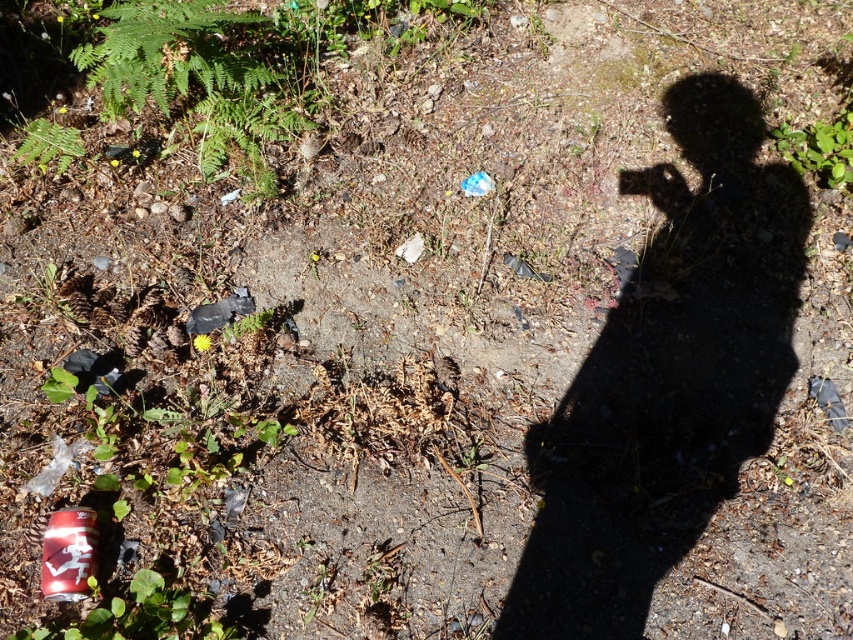
Question: Does red matte can at bottom left appear on the left side of green leafy weed at upper right?

Choices:
 (A) no
 (B) yes

Answer: (B)

Question: Which point is closer to the camera?

Choices:
 (A) red matte can at bottom left
 (B) green leafy weed at upper right

Answer: (A)

Question: Is red matte can at bottom left behind green leafy weed at upper right?

Choices:
 (A) yes
 (B) no

Answer: (B)

Question: Which of the following is the farthest from the observer?

Choices:
 (A) (70, 513)
 (B) (834, 176)

Answer: (B)

Question: Which point is closer to the camera?

Choices:
 (A) (61, 561)
 (B) (815, 140)

Answer: (A)

Question: Is red matte can at bottom left thinner than green leafy weed at upper right?

Choices:
 (A) yes
 (B) no

Answer: (A)